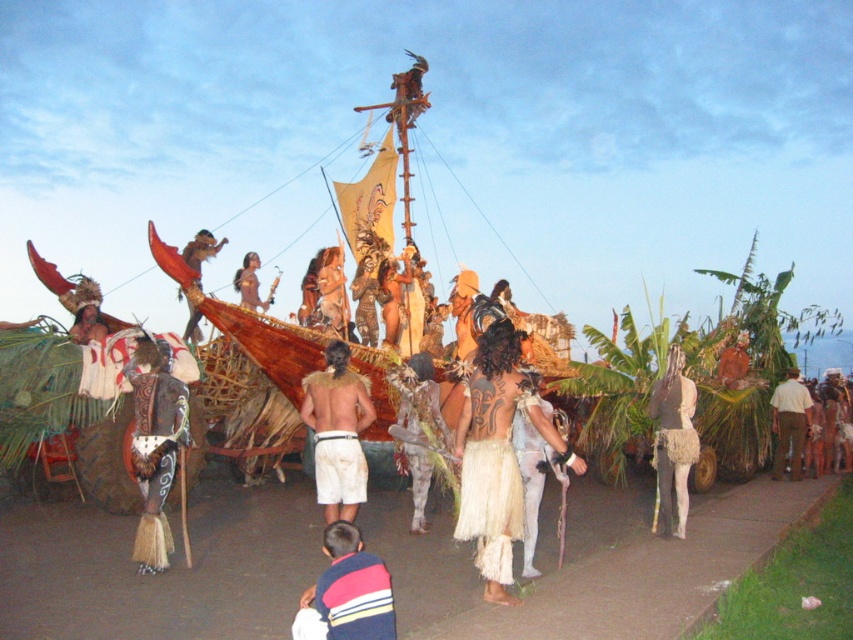
You are an anthropologist observing the cultural event and want to document the attire of the participants. Which of the two items, the striped sweater at lower center or the white fringed skirt at center, is shorter in height?

The striped sweater at lower center has a lesser height compared to the white fringed skirt at center, so the striped sweater at lower center is shorter in height.

What is located at the point with coordinates [337,433] in the image?

The point with coordinates [337,433] is on white woven shorts at center.

You are observing a cultural event and notice the striped sweater at lower center. Where exactly is the striped sweater positioned in relation to the other elements in the scene?

The striped sweater at lower center is located at point coordinates of (346, 593).